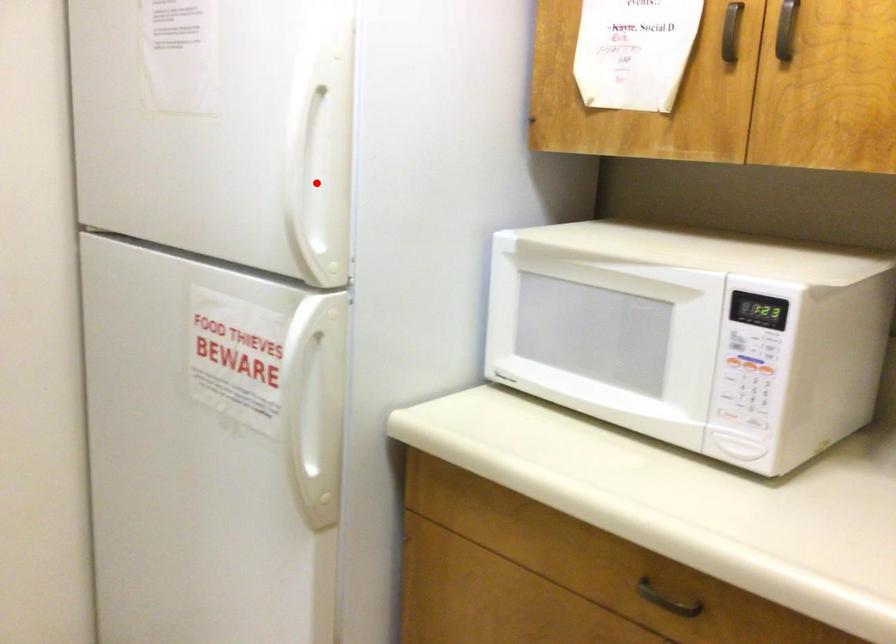
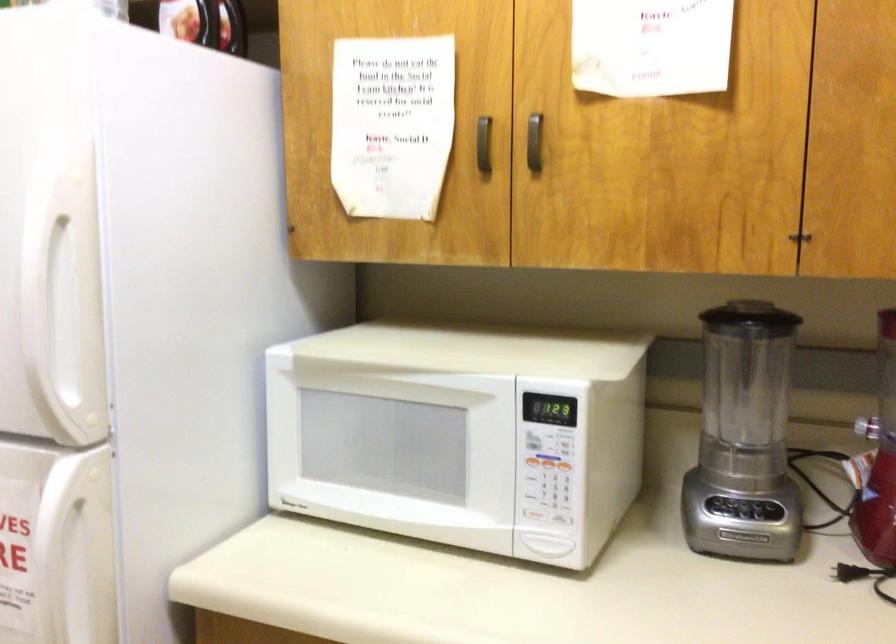
Question: I am providing you with two images of the same scene from different viewpoints. A red point is marked on the first image. Is the red point's position out of view in image 2?

Choices:
 (A) Yes
 (B) No

Answer: (B)